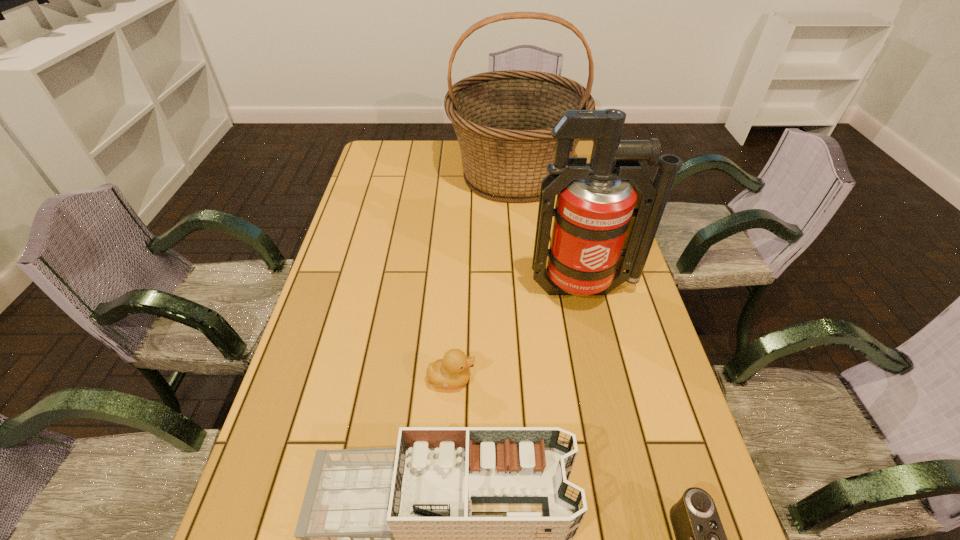
Find the location of `vacant space that satisfies the following two spatial constraints: 1. on the front side of the basket; 2. facing forward on the duckling`. vacant space that satisfies the following two spatial constraints: 1. on the front side of the basket; 2. facing forward on the duckling is located at coordinates (536, 379).

Find the location of a particular element. Image resolution: width=960 pixels, height=540 pixels. blank space that satisfies the following two spatial constraints: 1. on the front side of the farthest object; 2. facing forward on the duckling is located at coordinates (536, 379).

Find the location of a particular element. free space that satisfies the following two spatial constraints: 1. on the front side of the basket; 2. facing forward on the duckling is located at coordinates (536, 379).